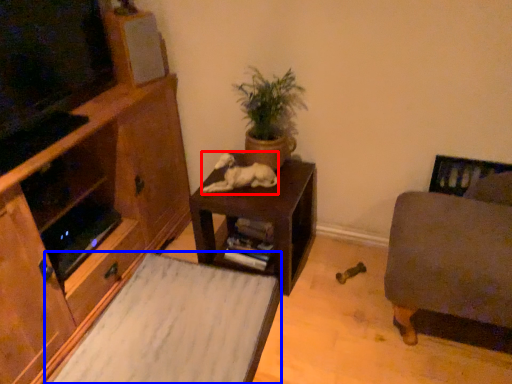
Question: Which object is further to the camera taking this photo, animal (highlighted by a red box) or plain (highlighted by a blue box)?

Choices:
 (A) animal
 (B) plain

Answer: (A)